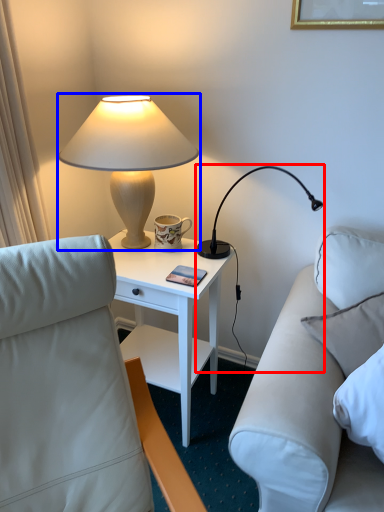
Question: Which object appears closest to the camera in this image, lamp (highlighted by a red box) or lamp (highlighted by a blue box)?

Choices:
 (A) lamp
 (B) lamp

Answer: (B)